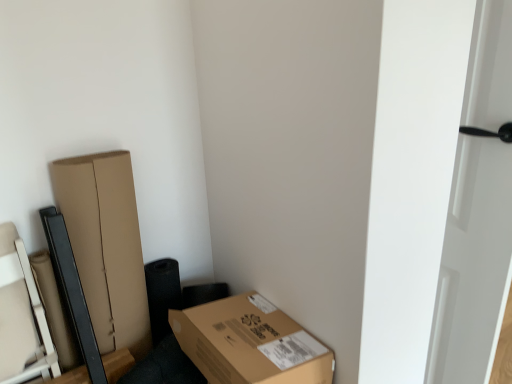
Question: From the image's perspective, is white glossy door at right below brown cardboard box at lower right?

Choices:
 (A) no
 (B) yes

Answer: (A)

Question: Can you confirm if white glossy door at right is positioned to the left of brown cardboard box at lower right?

Choices:
 (A) no
 (B) yes

Answer: (A)

Question: Does white glossy door at right appear on the right side of brown cardboard box at lower right?

Choices:
 (A) no
 (B) yes

Answer: (B)

Question: Is white glossy door at right taller than brown cardboard box at lower right?

Choices:
 (A) no
 (B) yes

Answer: (B)

Question: From the image's perspective, is white glossy door at right above brown cardboard box at lower right?

Choices:
 (A) yes
 (B) no

Answer: (A)

Question: From a real-world perspective, is white glossy door at right positioned under brown cardboard box at lower right based on gravity?

Choices:
 (A) yes
 (B) no

Answer: (B)

Question: From a real-world perspective, is brown cardboard box at lower right physically below white glossy door at right?

Choices:
 (A) yes
 (B) no

Answer: (A)

Question: Does brown cardboard box at lower right appear on the left side of white glossy door at right?

Choices:
 (A) yes
 (B) no

Answer: (A)

Question: Is white glossy door at right a part of brown cardboard box at lower right?

Choices:
 (A) no
 (B) yes

Answer: (A)

Question: Considering the relative positions of brown cardboard box at lower right and white glossy door at right in the image provided, is brown cardboard box at lower right to the right of white glossy door at right from the viewer's perspective?

Choices:
 (A) yes
 (B) no

Answer: (B)

Question: Is the position of brown cardboard box at lower right less distant than that of white glossy door at right?

Choices:
 (A) no
 (B) yes

Answer: (A)

Question: Is brown cardboard box at lower right shorter than white glossy door at right?

Choices:
 (A) yes
 (B) no

Answer: (A)

Question: From the image's perspective, relative to white glossy door at right, is brown cardboard box at lower right above or below?

Choices:
 (A) below
 (B) above

Answer: (A)